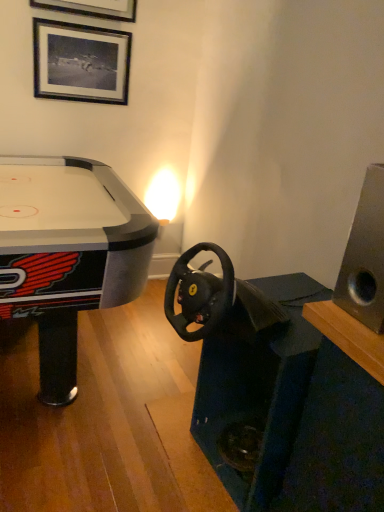
You are a GUI agent. You are given a task and a screenshot of the screen. Output one action in this format:
    pyautogui.click(x=<x>, y=<y>)
    Task: Click on the black matte picture frame at upper left
    Image resolution: width=384 pixels, height=512 pixels.
    Given the screenshot: What is the action you would take?
    pyautogui.click(x=81, y=62)

Image resolution: width=384 pixels, height=512 pixels. What do you see at coordinates (81, 62) in the screenshot? I see `black matte picture frame at upper left` at bounding box center [81, 62].

What is the approximate width of silver metallic speaker at right?

silver metallic speaker at right is 8.65 inches wide.

Find the location of a particular element. The image size is (384, 512). silver metallic speaker at right is located at coordinates (365, 256).

This screenshot has height=512, width=384. What do you see at coordinates (365, 256) in the screenshot? I see `silver metallic speaker at right` at bounding box center [365, 256].

Where is `black matte picture frame at upper left`? This screenshot has width=384, height=512. black matte picture frame at upper left is located at coordinates (81, 62).

Considering the relative positions of black matte picture frame at upper left and silver metallic speaker at right in the image provided, is black matte picture frame at upper left to the right of silver metallic speaker at right from the viewer's perspective?

No.

Is black matte picture frame at upper left in front of silver metallic speaker at right?

No, black matte picture frame at upper left is behind silver metallic speaker at right.

Does point (110, 58) lie in front of point (371, 255)?

No, (110, 58) is further to viewer.

From the image's perspective, which is above, black matte picture frame at upper left or silver metallic speaker at right?

black matte picture frame at upper left is shown above in the image.

From a real-world perspective, which object rests below the other?

silver metallic speaker at right, from a real-world perspective.

Looking at this image, considering the relative sizes of black matte picture frame at upper left and silver metallic speaker at right in the image provided, is black matte picture frame at upper left wider than silver metallic speaker at right?

No.

Is black matte picture frame at upper left taller than silver metallic speaker at right?

No.

Can you confirm if black matte picture frame at upper left is bigger than silver metallic speaker at right?

Actually, black matte picture frame at upper left might be smaller than silver metallic speaker at right.

Is black matte picture frame at upper left situated inside silver metallic speaker at right or outside?

black matte picture frame at upper left is located beyond the bounds of silver metallic speaker at right.

Would you say black matte picture frame at upper left is a long distance from silver metallic speaker at right?

black matte picture frame at upper left is positioned a significant distance from silver metallic speaker at right.

Is black matte picture frame at upper left facing towards silver metallic speaker at right?

Yes, black matte picture frame at upper left is aimed at silver metallic speaker at right.

What's the angular difference between black matte picture frame at upper left and silver metallic speaker at right's facing directions?

black matte picture frame at upper left and silver metallic speaker at right are facing 87.7 degrees away from each other.

The width and height of the screenshot is (384, 512). In order to click on picture frame behind the silver metallic speaker at right in this screenshot , I will do `click(81, 62)`.

Between silver metallic speaker at right and black matte picture frame at upper left, which one appears on the right side from the viewer's perspective?

silver metallic speaker at right is more to the right.

Which object is more forward, silver metallic speaker at right or black matte picture frame at upper left?

silver metallic speaker at right is more forward.

Considering the points (371, 270) and (55, 46), which point is in front, point (371, 270) or point (55, 46)?

The point (371, 270) is closer.

From the image's perspective, is silver metallic speaker at right located beneath black matte picture frame at upper left?

Yes.

From a real-world perspective, is silver metallic speaker at right physically located above or below black matte picture frame at upper left?

silver metallic speaker at right is situated lower than black matte picture frame at upper left in the real world.

In terms of width, does silver metallic speaker at right look wider or thinner when compared to black matte picture frame at upper left?

In the image, silver metallic speaker at right appears to be wider than black matte picture frame at upper left.

Between silver metallic speaker at right and black matte picture frame at upper left, which one has less height?

black matte picture frame at upper left is shorter.

Based on their sizes in the image, would you say silver metallic speaker at right is bigger or smaller than black matte picture frame at upper left?

silver metallic speaker at right is bigger than black matte picture frame at upper left.

Can black matte picture frame at upper left be found inside silver metallic speaker at right?

No, silver metallic speaker at right does not contain black matte picture frame at upper left.

Would you consider silver metallic speaker at right to be distant from black matte picture frame at upper left?

That's right, there is a large distance between silver metallic speaker at right and black matte picture frame at upper left.

Is silver metallic speaker at right facing away from black matte picture frame at upper left?

No, black matte picture frame at upper left is not at the back of silver metallic speaker at right.

How many degrees apart are the facing directions of silver metallic speaker at right and black matte picture frame at upper left?

The angular difference between silver metallic speaker at right and black matte picture frame at upper left is 87.7 degrees.

Measure the distance from silver metallic speaker at right to black matte picture frame at upper left.

silver metallic speaker at right and black matte picture frame at upper left are 5.71 feet apart.

The image size is (384, 512). What are the coordinates of `picture frame that is on the left side of silver metallic speaker at right` in the screenshot? It's located at (81, 62).

Find the location of `speaker in front of the black matte picture frame at upper left`. speaker in front of the black matte picture frame at upper left is located at coordinates (365, 256).

You are a GUI agent. You are given a task and a screenshot of the screen. Output one action in this format:
    pyautogui.click(x=<x>, y=<y>)
    Task: Click on the speaker below the black matte picture frame at upper left (from a real-world perspective)
    The height and width of the screenshot is (512, 384).
    Given the screenshot: What is the action you would take?
    coord(365,256)